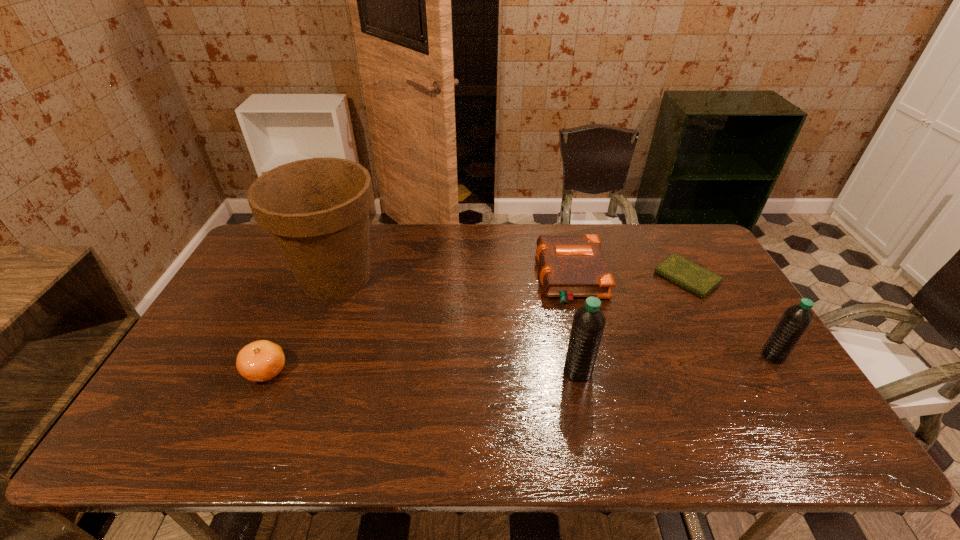
Where is `vacant area situated on the spine side of the Bible`? The height and width of the screenshot is (540, 960). vacant area situated on the spine side of the Bible is located at coordinates (429, 276).

Image resolution: width=960 pixels, height=540 pixels. Identify the location of vacant space located on the spine side of the Bible. (451, 276).

This screenshot has height=540, width=960. Find the location of `free space located 0.250m on the spine side of the Bible`. free space located 0.250m on the spine side of the Bible is located at coordinates (460, 276).

Find the location of a particular element. vacant space located on the right of the flowerpot is located at coordinates (423, 277).

The width and height of the screenshot is (960, 540). Find the location of `free region located 0.170m on the back of the diary`. free region located 0.170m on the back of the diary is located at coordinates (660, 230).

Where is `vacant space located 0.090m on the right of the fourth tallest object`? vacant space located 0.090m on the right of the fourth tallest object is located at coordinates (323, 371).

Find the location of a particular element. The width and height of the screenshot is (960, 540). Bible situated at the far edge is located at coordinates (571, 266).

Where is `flowerpot positioned at the far edge`? The image size is (960, 540). flowerpot positioned at the far edge is located at coordinates (317, 210).

Where is `diary that is at the far edge`? This screenshot has height=540, width=960. diary that is at the far edge is located at coordinates (694, 278).

You are a GUI agent. You are given a task and a screenshot of the screen. Output one action in this format:
    pyautogui.click(x=<x>, y=<y>)
    Task: Click on the object positioned at the near edge
    
    Given the screenshot: What is the action you would take?
    pyautogui.click(x=260, y=361)